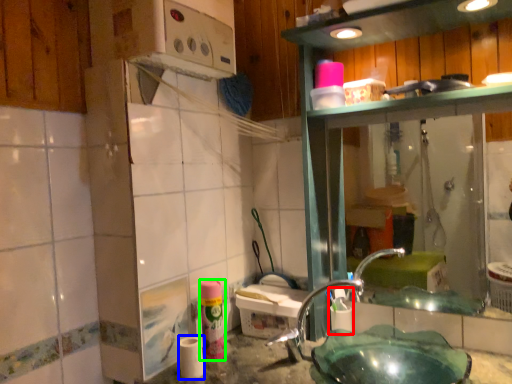
Question: Based on their relative distances, which object is farther from shaving cream (highlighted by a red box)? Choose from toilet paper (highlighted by a blue box) and toiletry (highlighted by a green box).

Choices:
 (A) toilet paper
 (B) toiletry

Answer: (A)